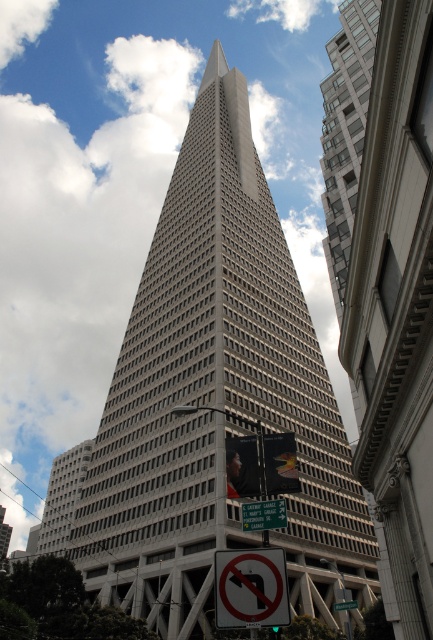
You are a delivery driver approaching the intersection near the Transamerica Pyramid. You see the green plastic street sign at center and the white plastic street sign at center. Which one is placed higher up?

The green plastic street sign at center is positioned over the white plastic street sign at center, so the green plastic street sign at center is placed higher up.

You are a delivery driver approaching the intersection near the Transamerica Pyramid. You see the white plastic sign at lower center and the white plastic street sign at center. Which sign is shorter?

The white plastic sign at lower center is not as tall as the white plastic street sign at center, so the white plastic sign at lower center is shorter.

You are a delivery driver approaching the intersection near the Transamerica Pyramid. You see the white plastic sign at lower center and the green plastic street sign at center. Which sign is bigger?

The white plastic sign at lower center has a larger size compared to the green plastic street sign at center, so the white plastic sign at lower center is bigger.